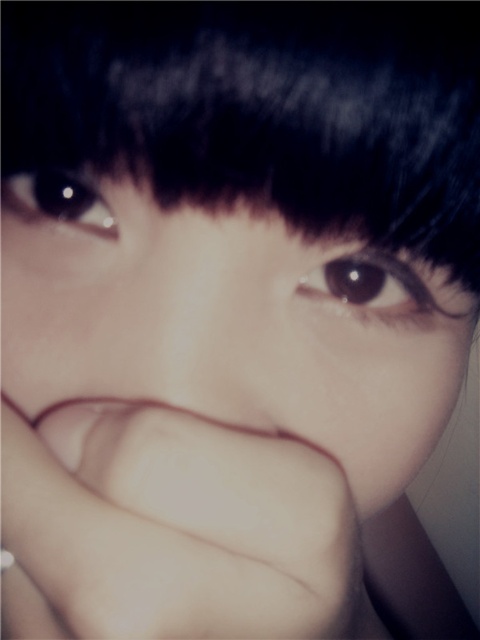
Question: Based on their relative distances, which object is farther from the black matte hair at upper center?

Choices:
 (A) smooth skin hand at center
 (B) brown glossy eye at center
 (C) brown glossy eye at upper left

Answer: (A)

Question: Does smooth skin hand at center have a greater width compared to brown glossy eye at upper left?

Choices:
 (A) yes
 (B) no

Answer: (A)

Question: Which of the following is the farthest from the observer?

Choices:
 (A) (87, 532)
 (B) (96, 236)
 (C) (339, 260)
 (D) (371, 36)

Answer: (C)

Question: Estimate the real-world distances between objects in this image. Which object is farther from the black matte hair at upper center?

Choices:
 (A) brown glossy eye at center
 (B) brown glossy eye at upper left

Answer: (B)

Question: Is black matte hair at upper center to the right of brown glossy eye at center from the viewer's perspective?

Choices:
 (A) yes
 (B) no

Answer: (B)

Question: Can you confirm if smooth skin hand at center is wider than brown glossy eye at upper left?

Choices:
 (A) no
 (B) yes

Answer: (B)